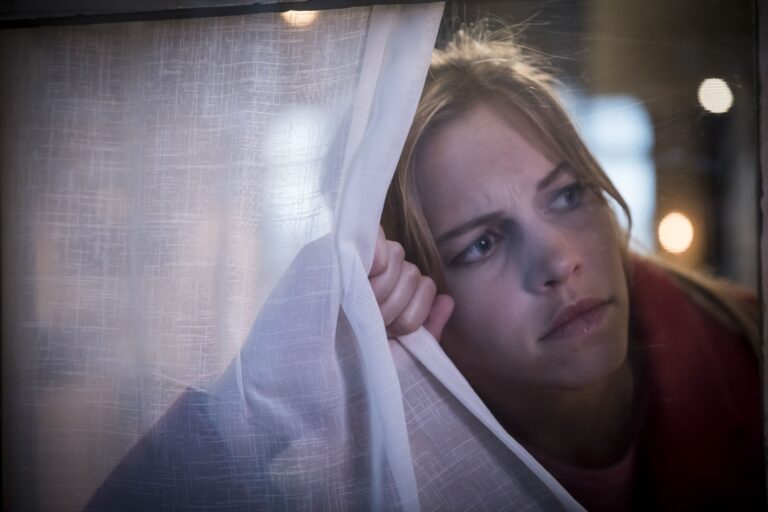
Find the location of `lights`. lights is located at coordinates (710, 106), (674, 231), (305, 12).